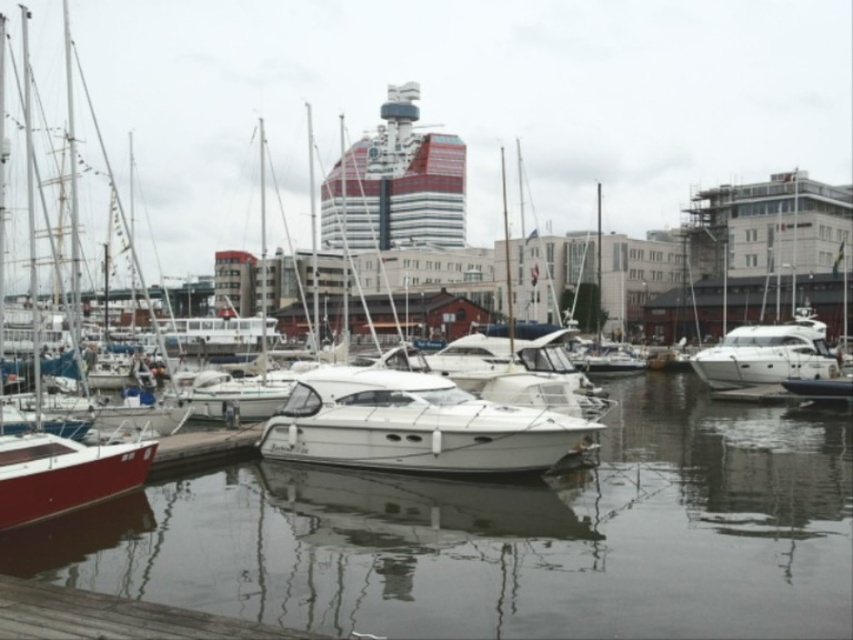
You are a photographer planning to take a photo of the red and white glass cruise ship at center and the white glossy yacht at right from the pier. Which boat should you focus on if you want to capture the one that is significantly taller?

The red and white glass cruise ship at center is much taller than the white glossy yacht at right, so you should focus on the red and white glass cruise ship at center to capture the taller boat.

You are a photographer planning to capture the red and white glass cruise ship at center and the white glossy yacht at right in a single shot. Based on their positions, will the cruise ship block the view of the yacht in your photo?

The red and white glass cruise ship at center is above the white glossy yacht at right, so the cruise ship will not block the view of the yacht in the photo.

You are standing on the pier and want to walk to the white glossy yacht at right. Which direction should you move relative to the glossy water at center?

You should move to the right relative to the glossy water at center because the white glossy yacht at right is positioned to the right of the glossy water at center.